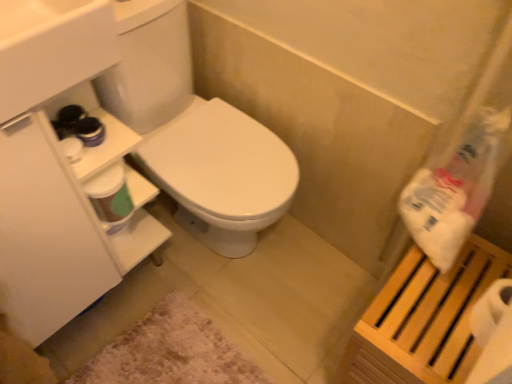
Question: From the image's perspective, is white matte toilet paper at right over wooden slatted shelf at right?

Choices:
 (A) yes
 (B) no

Answer: (A)

Question: Could wooden slatted shelf at right be considered to be inside white matte toilet paper at right?

Choices:
 (A) no
 (B) yes

Answer: (A)

Question: Does white matte toilet paper at right have a lesser height compared to wooden slatted shelf at right?

Choices:
 (A) yes
 (B) no

Answer: (A)

Question: Can you see white matte toilet paper at right touching wooden slatted shelf at right?

Choices:
 (A) no
 (B) yes

Answer: (A)

Question: Can you confirm if white matte toilet paper at right is positioned to the right of wooden slatted shelf at right?

Choices:
 (A) yes
 (B) no

Answer: (A)

Question: Is white matte toilet paper at right at the left side of wooden slatted shelf at right?

Choices:
 (A) yes
 (B) no

Answer: (B)

Question: Considering the relative sizes of white fluffy bath mat at lower center and white glossy sink at upper left in the image provided, is white fluffy bath mat at lower center wider than white glossy sink at upper left?

Choices:
 (A) yes
 (B) no

Answer: (A)

Question: From the image's perspective, is white fluffy bath mat at lower center over white glossy sink at upper left?

Choices:
 (A) no
 (B) yes

Answer: (A)

Question: Considering the relative positions of white fluffy bath mat at lower center and white glossy sink at upper left in the image provided, is white fluffy bath mat at lower center behind white glossy sink at upper left?

Choices:
 (A) yes
 (B) no

Answer: (A)

Question: From a real-world perspective, is white fluffy bath mat at lower center physically above white glossy sink at upper left?

Choices:
 (A) yes
 (B) no

Answer: (B)

Question: Are white fluffy bath mat at lower center and white glossy sink at upper left far apart?

Choices:
 (A) no
 (B) yes

Answer: (A)

Question: Is white fluffy bath mat at lower center shorter than white glossy sink at upper left?

Choices:
 (A) yes
 (B) no

Answer: (A)

Question: Can you confirm if white plastic bag at upper right is positioned to the left of wooden slatted shelf at right?

Choices:
 (A) yes
 (B) no

Answer: (A)